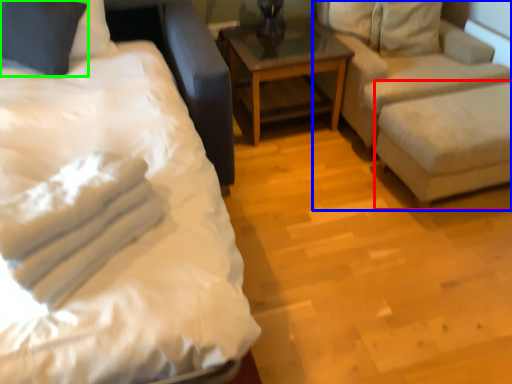
Question: Estimate the real-world distances between objects in this image. Which object is closer to swivel chair (highlighted by a red box), studio couch (highlighted by a blue box) or pillow (highlighted by a green box)?

Choices:
 (A) studio couch
 (B) pillow

Answer: (A)